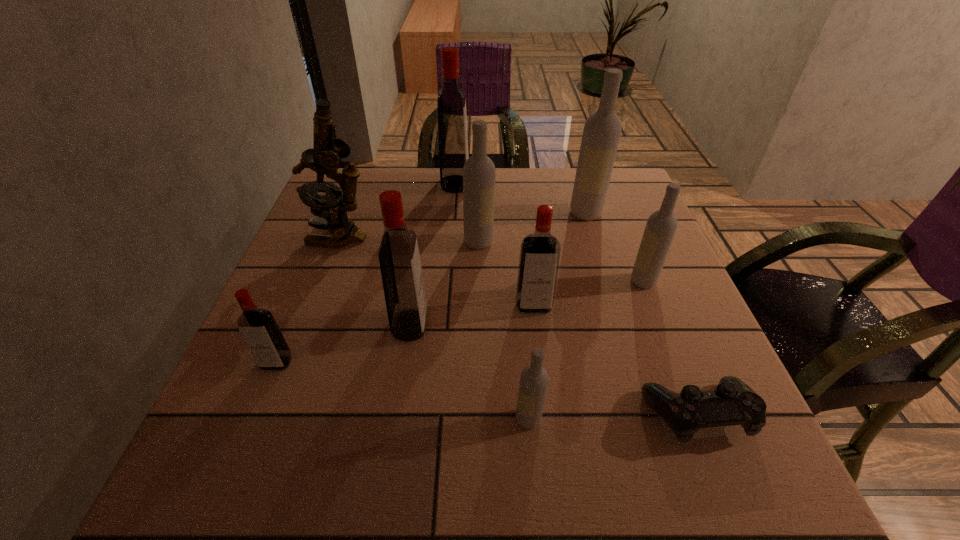
You are a GUI agent. You are given a task and a screenshot of the screen. Output one action in this format:
    pyautogui.click(x=<x>, y=<y>)
    Task: Click on the rightmost red vodka
    The height and width of the screenshot is (540, 960).
    Given the screenshot: What is the action you would take?
    click(539, 258)

I want to click on the smallest red vodka, so click(258, 327).

The image size is (960, 540). Identify the location of the second nearest vodka. (258, 327).

Find the location of a particular element. the nearest white vodka is located at coordinates (533, 384).

Where is `the third white vodka from right to left`? the third white vodka from right to left is located at coordinates (533, 384).

I want to click on control, so click(x=732, y=402).

The height and width of the screenshot is (540, 960). Find the location of `vacant space located 0.220m on the front and back of the farthest vodka`. vacant space located 0.220m on the front and back of the farthest vodka is located at coordinates (546, 184).

What are the coordinates of `free space located on the back of the farthest white vodka` in the screenshot? It's located at (576, 180).

Where is `free space located 0.220m on the back of the microscope`? Image resolution: width=960 pixels, height=540 pixels. free space located 0.220m on the back of the microscope is located at coordinates (364, 178).

Find the location of a particular element. vacant space located on the right of the sixth nearest vodka is located at coordinates (547, 242).